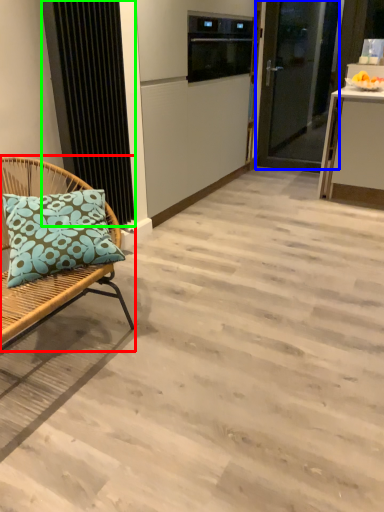
Question: Based on their relative distances, which object is farther from chair (highlighted by a red box)? Choose from door (highlighted by a blue box) and radiator (highlighted by a green box).

Choices:
 (A) door
 (B) radiator

Answer: (A)